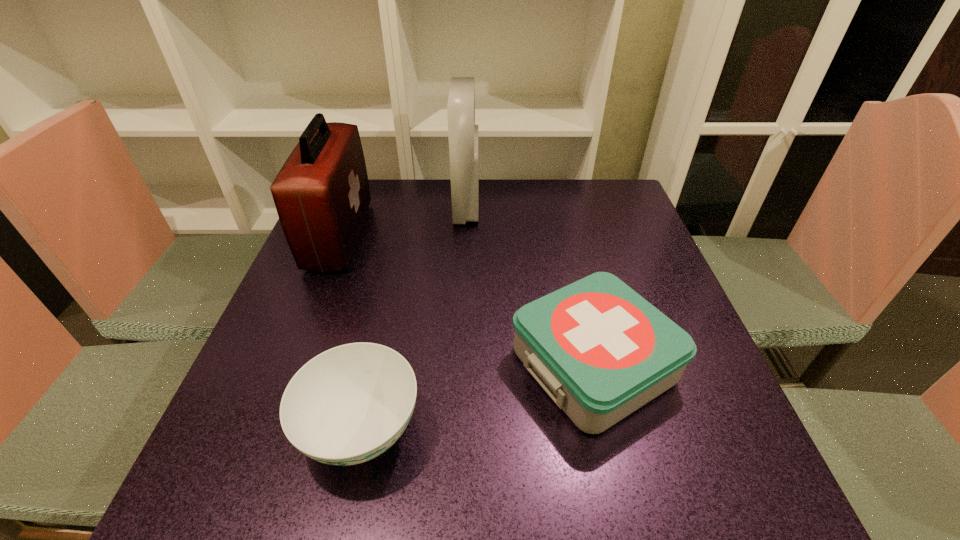
I want to click on free spot that satisfies the following two spatial constraints: 1. on the side of the leftmost object with the cross symbol; 2. on the back side of the chinaware, so click(x=263, y=430).

Where is `free space that satisfies the following two spatial constraints: 1. on the back side of the second object from left to right; 2. on the left side of the rightmost object`? The height and width of the screenshot is (540, 960). free space that satisfies the following two spatial constraints: 1. on the back side of the second object from left to right; 2. on the left side of the rightmost object is located at coordinates (375, 364).